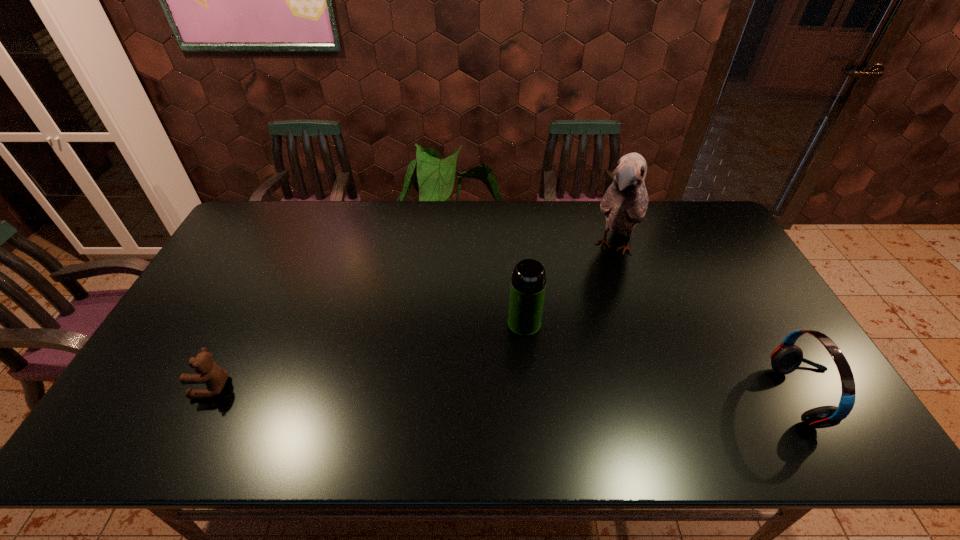
The image size is (960, 540). I want to click on vacant space on the desktop that is between the teddy bear and the headset and is positioned on the front-facing side of the parrot, so click(547, 393).

The height and width of the screenshot is (540, 960). Identify the location of vacant space on the desktop that is between the shortest object and the headset and is positioned from the spout of the thermos bottle. (454, 391).